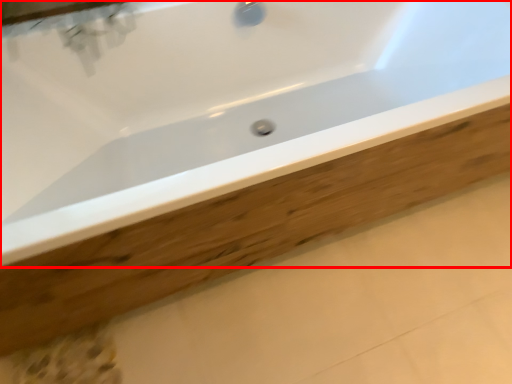
Question: Where is bathtub (annotated by the red box) located in relation to plank in the image?

Choices:
 (A) left
 (B) right

Answer: (A)